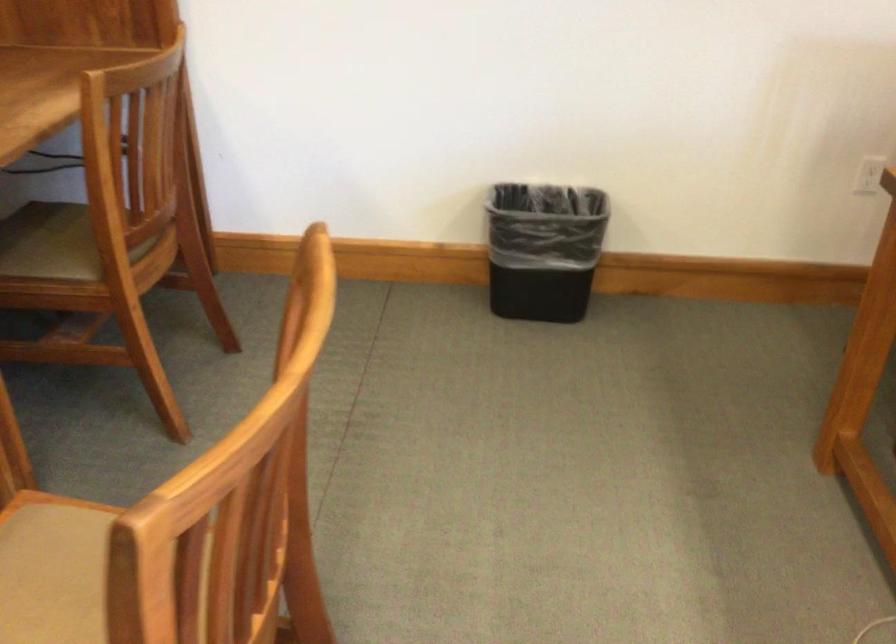
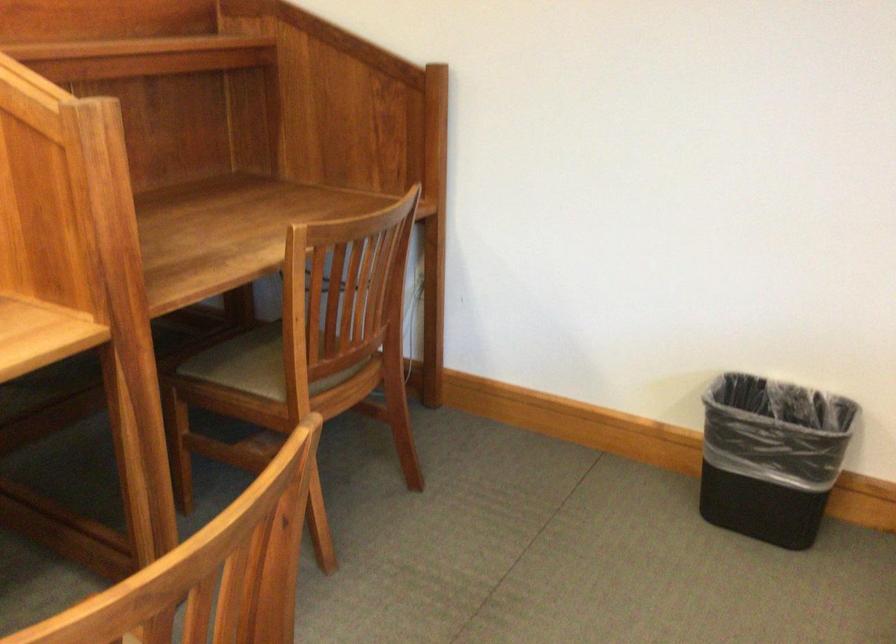
Where in the second image is the point corresponding to (547,251) from the first image?

(771, 456)